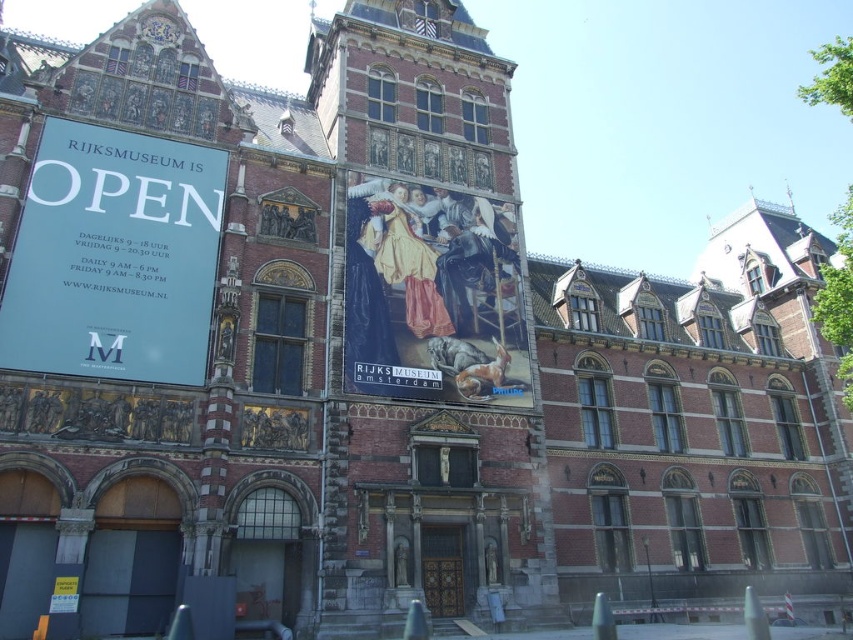
What is the relationship in size between the white paper sign at left and the gold metallic clock at upper center?

The white paper sign at left is larger in size than the gold metallic clock at upper center.

You are standing in front of the Rijksmuseum and want to check the time using the gold metallic clock at upper center. However, you notice a white paper sign at left nearby. How far apart are these two objects?

The white paper sign at left and the gold metallic clock at upper center are 13.97 meters apart from each other.